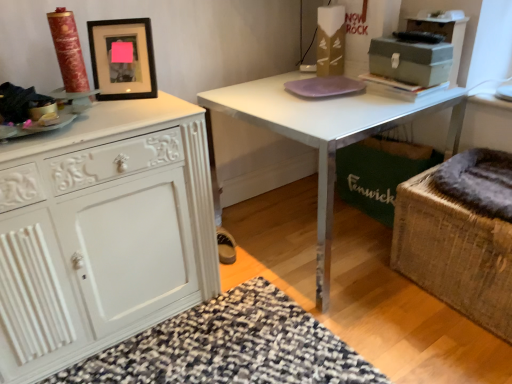
Describe the element at coordinates (123, 58) in the screenshot. I see `black matte picture frame at upper left` at that location.

Where is `white painted wood cabinet at left`? white painted wood cabinet at left is located at coordinates (102, 232).

This screenshot has width=512, height=384. What do you see at coordinates (328, 133) in the screenshot? I see `white glossy table at center` at bounding box center [328, 133].

Identify the location of purple glass plate at center. The width and height of the screenshot is (512, 384). (324, 86).

From the picture: Looking at the image, does rattan wicker swivel chair at lower right, the 1th swivel chair when ordered from bottom to top, seem bigger or smaller compared to white glossy table at center?

In the image, rattan wicker swivel chair at lower right, the 1th swivel chair when ordered from bottom to top, appears to be smaller than white glossy table at center.

Does rattan wicker swivel chair at lower right, marked as the second swivel chair in a top-to-bottom arrangement, turn towards white glossy table at center?

No, rattan wicker swivel chair at lower right, marked as the second swivel chair in a top-to-bottom arrangement, is not aimed at white glossy table at center.

Who is taller, rattan wicker swivel chair at lower right, marked as the second swivel chair in a top-to-bottom arrangement, or white glossy table at center?

white glossy table at center.

Is rattan wicker swivel chair at lower right, the 1th swivel chair when ordered from bottom to top, touching white glossy table at center?

They are not placed beside each other.

Is black matte picture frame at upper left at the right side of rattan wicker swivel chair at lower right, marked as the second swivel chair in a top-to-bottom arrangement?

Incorrect, black matte picture frame at upper left is not on the right side of rattan wicker swivel chair at lower right, marked as the second swivel chair in a top-to-bottom arrangement.

From a real-world perspective, is black matte picture frame at upper left above or below rattan wicker swivel chair at lower right, the 1th swivel chair when ordered from bottom to top?

black matte picture frame at upper left is above rattan wicker swivel chair at lower right, the 1th swivel chair when ordered from bottom to top.

Are black matte picture frame at upper left and rattan wicker swivel chair at lower right, marked as the second swivel chair in a top-to-bottom arrangement, located far from each other?

That's right, there is a large distance between black matte picture frame at upper left and rattan wicker swivel chair at lower right, marked as the second swivel chair in a top-to-bottom arrangement.

Is black matte picture frame at upper left thinner than rattan wicker swivel chair at lower right, marked as the second swivel chair in a top-to-bottom arrangement?

Correct, the width of black matte picture frame at upper left is less than that of rattan wicker swivel chair at lower right, marked as the second swivel chair in a top-to-bottom arrangement.

Could you tell me if purple glass plate at center is turned towards metallic gray cabinet at upper right?

No, purple glass plate at center is not facing towards metallic gray cabinet at upper right.

From a real-world perspective, is purple glass plate at center below metallic gray cabinet at upper right?

Yes.

Who is smaller, purple glass plate at center or metallic gray cabinet at upper right?

With smaller size is purple glass plate at center.

Could you tell me if matte gray metal box at upper right is turned towards rattan wicker swivel chair at lower right, the 1th swivel chair when ordered from bottom to top?

No, matte gray metal box at upper right is not facing towards rattan wicker swivel chair at lower right, the 1th swivel chair when ordered from bottom to top.

Between matte gray metal box at upper right and rattan wicker swivel chair at lower right, marked as the second swivel chair in a top-to-bottom arrangement, which one has larger width?

rattan wicker swivel chair at lower right, marked as the second swivel chair in a top-to-bottom arrangement, is wider.

How many degrees apart are the facing directions of matte gray metal box at upper right and rattan wicker swivel chair at lower right, marked as the second swivel chair in a top-to-bottom arrangement?

They differ by 0.882 degrees in their facing directions.

Consider the image. Considering the sizes of matte gray metal box at upper right and rattan wicker swivel chair at lower right, marked as the second swivel chair in a top-to-bottom arrangement, in the image, is matte gray metal box at upper right bigger or smaller than rattan wicker swivel chair at lower right, marked as the second swivel chair in a top-to-bottom arrangement,?

Considering their sizes, matte gray metal box at upper right takes up less space than rattan wicker swivel chair at lower right, marked as the second swivel chair in a top-to-bottom arrangement.

Does point (466, 167) lie behind point (442, 29)?

Yes, it is.

From a real-world perspective, is dark gray plush at right, the 2th swivel chair from the bottom, on metallic gray cabinet at upper right?

No, from a real-world perspective, dark gray plush at right, the 2th swivel chair from the bottom, is not above metallic gray cabinet at upper right.

From the image's perspective, which object appears higher, dark gray plush at right, the 2th swivel chair from the bottom, or metallic gray cabinet at upper right?

metallic gray cabinet at upper right appears higher in the image.

Is dark gray plush at right, which ranks as the 1th swivel chair in top-to-bottom order, placed right next to metallic gray cabinet at upper right?

No, dark gray plush at right, which ranks as the 1th swivel chair in top-to-bottom order, is not beside metallic gray cabinet at upper right.

Does purple glass plate at center appear on the right side of white glossy table at center?

No.

Who is smaller, purple glass plate at center or white glossy table at center?

purple glass plate at center.

This screenshot has height=384, width=512. Identify the location of table lying in front of the purple glass plate at center. (328, 133).

Between purple glass plate at center and white glossy table at center, which one has less height?

purple glass plate at center is shorter.

Is black matte picture frame at upper left spatially inside dark gray plush at right, which ranks as the 1th swivel chair in top-to-bottom order, or outside of it?

black matte picture frame at upper left is not enclosed by dark gray plush at right, which ranks as the 1th swivel chair in top-to-bottom order.

Starting from the black matte picture frame at upper left, which swivel chair is the 1st one to the right? Please provide its 2D coordinates.

[(479, 181)]

Is black matte picture frame at upper left facing away from dark gray plush at right, which ranks as the 1th swivel chair in top-to-bottom order?

No, black matte picture frame at upper left is not facing the opposite direction of dark gray plush at right, which ranks as the 1th swivel chair in top-to-bottom order.

Can you tell me how much black matte picture frame at upper left and dark gray plush at right, the 2th swivel chair from the bottom, differ in facing direction?

black matte picture frame at upper left and dark gray plush at right, the 2th swivel chair from the bottom, are facing 52.8 degrees away from each other.

This screenshot has width=512, height=384. I want to click on table that appears on the left of rattan wicker swivel chair at lower right, the 1th swivel chair when ordered from bottom to top, so click(x=328, y=133).

Identify the location of picture frame above the rattan wicker swivel chair at lower right, the 1th swivel chair when ordered from bottom to top (from a real-world perspective). (123, 58).

Looking at the image, which one is located further to black matte picture frame at upper left, rattan wicker swivel chair at lower right, marked as the second swivel chair in a top-to-bottom arrangement, or matte gray metal box at upper right?

Based on the image, rattan wicker swivel chair at lower right, marked as the second swivel chair in a top-to-bottom arrangement, appears to be further to black matte picture frame at upper left.

Estimate the real-world distances between objects in this image. Which object is further from matte gray metal box at upper right, metallic gray cabinet at upper right or black matte picture frame at upper left?

The object further to matte gray metal box at upper right is black matte picture frame at upper left.

From the image, which object appears to be farther from rattan wicker swivel chair at lower right, marked as the second swivel chair in a top-to-bottom arrangement, white glossy table at center or black matte picture frame at upper left?

black matte picture frame at upper left is further to rattan wicker swivel chair at lower right, marked as the second swivel chair in a top-to-bottom arrangement.

Based on their spatial positions, is purple glass plate at center or dark gray plush at right, the 2th swivel chair from the bottom, closer to metallic gray cabinet at upper right?

purple glass plate at center lies closer to metallic gray cabinet at upper right than the other object.

Looking at the image, which one is located closer to matte gray metal box at upper right, white painted wood cabinet at left or dark gray plush at right, which ranks as the 1th swivel chair in top-to-bottom order?

The object closer to matte gray metal box at upper right is dark gray plush at right, which ranks as the 1th swivel chair in top-to-bottom order.

Based on their spatial positions, is metallic gray cabinet at upper right or black matte picture frame at upper left further from rattan wicker swivel chair at lower right, the 1th swivel chair when ordered from bottom to top?

black matte picture frame at upper left.

Looking at the image, which one is located closer to rattan wicker swivel chair at lower right, the 1th swivel chair when ordered from bottom to top, black matte picture frame at upper left or white painted wood cabinet at left?

Among the two, white painted wood cabinet at left is located nearer to rattan wicker swivel chair at lower right, the 1th swivel chair when ordered from bottom to top.

Estimate the real-world distances between objects in this image. Which object is further from white glossy table at center, matte gray metal box at upper right or black matte picture frame at upper left?

black matte picture frame at upper left is positioned further to the anchor white glossy table at center.

Image resolution: width=512 pixels, height=384 pixels. What are the coordinates of `cabinetry located between white glossy table at center and dark gray plush at right, which ranks as the 1th swivel chair in top-to-bottom order, in the left-right direction` in the screenshot? It's located at (444, 36).

You are a GUI agent. You are given a task and a screenshot of the screen. Output one action in this format:
    pyautogui.click(x=<x>, y=<y>)
    Task: Click on the table between black matte picture frame at upper left and metallic gray cabinet at upper right
    Image resolution: width=512 pixels, height=384 pixels.
    Given the screenshot: What is the action you would take?
    [328, 133]

At what (x,y) coordinates should I click in order to perform the action: click on cabinetry between black matte picture frame at upper left and rattan wicker swivel chair at lower right, marked as the second swivel chair in a top-to-bottom arrangement. Please return your answer as a coordinate pair (x, y). The height and width of the screenshot is (384, 512). Looking at the image, I should click on (444, 36).

Locate an element on the screen. The image size is (512, 384). pad between black matte picture frame at upper left and metallic gray cabinet at upper right in the horizontal direction is located at coordinates (324, 86).